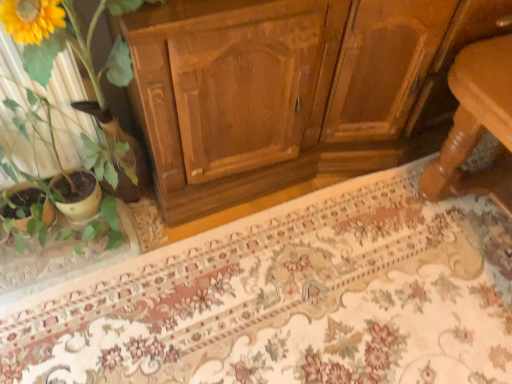
Where is `free space in front of matte yellow pot at left`? The image size is (512, 384). free space in front of matte yellow pot at left is located at coordinates (62, 305).